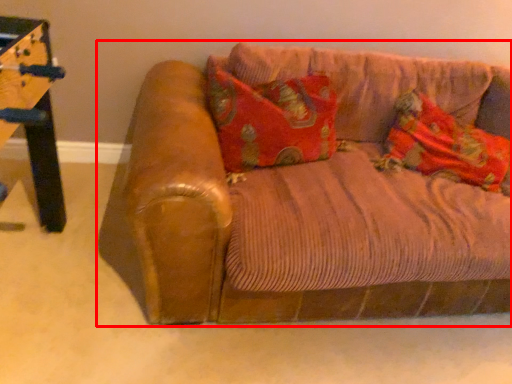
Question: From the image's perspective, what is the correct spatial relationship of studio couch (annotated by the red box) in relation to material?

Choices:
 (A) below
 (B) above

Answer: (A)